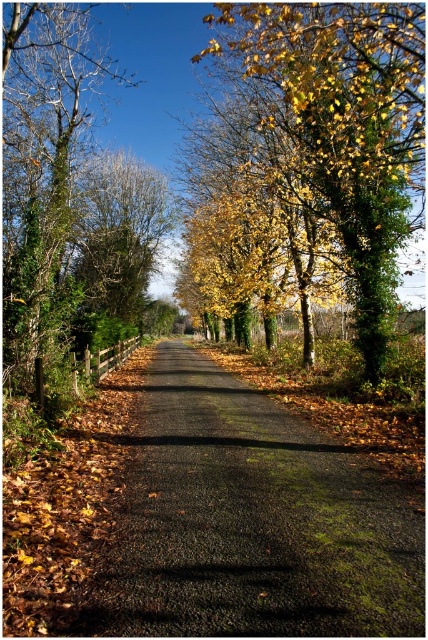
Question: Which point is closer to the camera?

Choices:
 (A) (35, 253)
 (B) (395, 604)
 (C) (211, 164)

Answer: (B)

Question: Which point appears farthest from the camera in this image?

Choices:
 (A) (374, 342)
 (B) (62, 189)

Answer: (B)

Question: Is dark asphalt road at center closer to the viewer compared to yellow-green leaves at center?

Choices:
 (A) yes
 (B) no

Answer: (A)

Question: Is dark asphalt road at center above green leafy tree at left?

Choices:
 (A) yes
 (B) no

Answer: (B)

Question: Can you confirm if dark asphalt road at center is positioned to the right of green leafy tree at left?

Choices:
 (A) no
 (B) yes

Answer: (B)

Question: Estimate the real-world distances between objects in this image. Which object is closer to the green leafy tree at left?

Choices:
 (A) dark asphalt road at center
 (B) yellow-green leaves at center

Answer: (B)